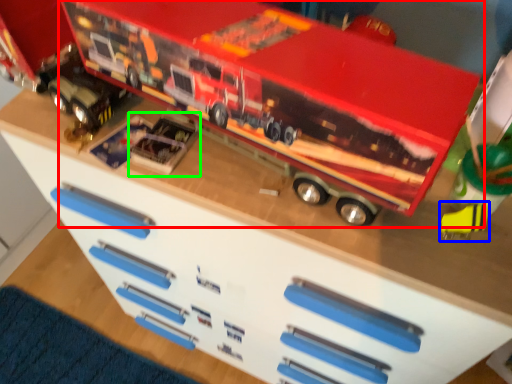
Question: Estimate the real-world distances between objects in this image. Which object is closer to toy (highlighted by a red box), toy (highlighted by a blue box) or toy (highlighted by a green box)?

Choices:
 (A) toy
 (B) toy

Answer: (B)